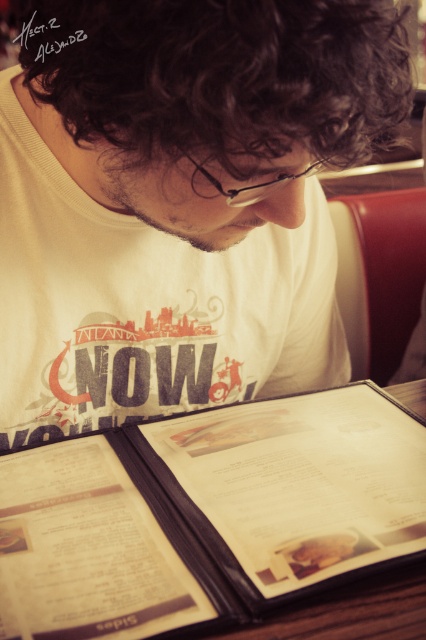
You are a delivery person who needs to place a small package on the table in the image. The package must be placed exactly at the point with coordinates point (88,556). Given that the package is 2 inches thick, will it fit without overlapping any objects on the table?

The distance of point (88,556) from viewer is 21.65 inches. Since the package is only 2 inches thick, it will fit at that point without overlapping any objects on the table.